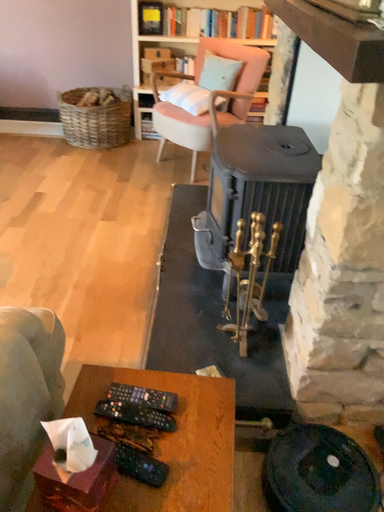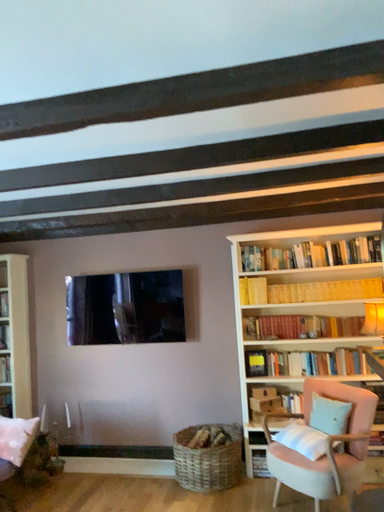
Question: How did the camera likely rotate when shooting the video?

Choices:
 (A) rotated downward
 (B) rotated upward

Answer: (B)